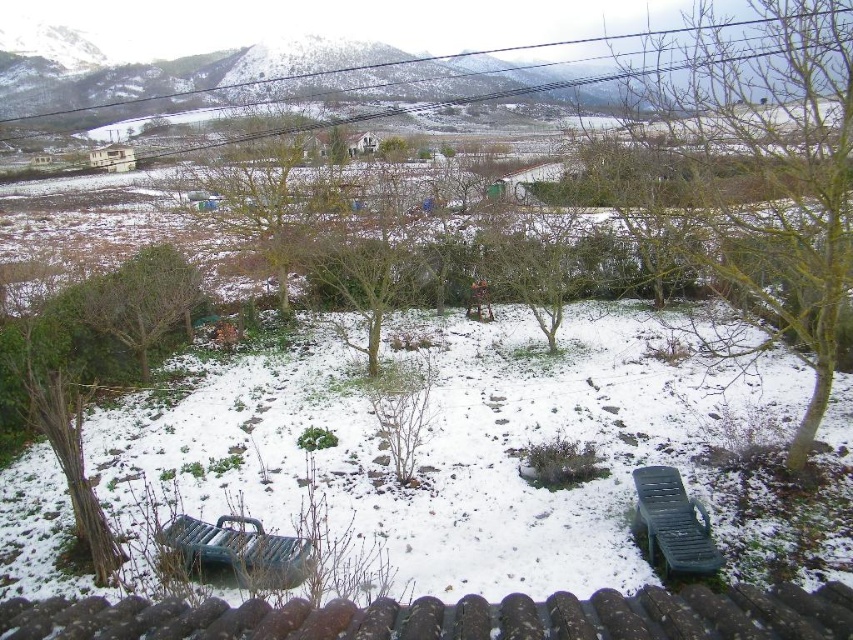
You are standing on the balcony looking at the snowy landscape. You see the green leafy tree at left and the green plastic park bench at lower right. Which object is closer to you?

The green leafy tree at left is closer to you because it is further to the viewer than the green plastic park bench at lower right.

You are standing on a balcony overlooking a snowy garden. You notice a green leafy tree at left and a green plastic park bench at lower center. Which object has a narrower width?

The green leafy tree at left is thinner than the green plastic park bench at lower center, so the green leafy tree at left has a narrower width.